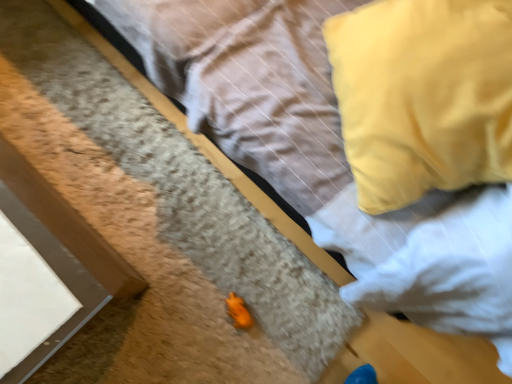
This screenshot has height=384, width=512. I want to click on free space to the right of orange matte toy frog at lower center, so click(290, 333).